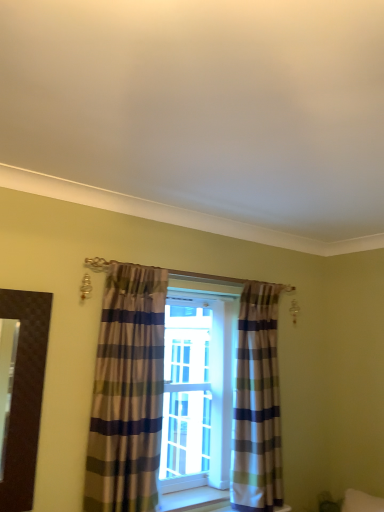
Question: From the image's perspective, is striped fabric curtain at center, the 1th curtain viewed from the right, above or below striped fabric curtain at center, which is the 1th curtain from front to back?

Choices:
 (A) below
 (B) above

Answer: (A)

Question: Looking at the image, does striped fabric curtain at center, acting as the 1th curtain starting from the back, seem bigger or smaller compared to striped fabric curtain at center, arranged as the first curtain when viewed from the left?

Choices:
 (A) small
 (B) big

Answer: (B)

Question: In the image, is striped fabric curtain at center, acting as the 1th curtain starting from the back, positioned in front of or behind striped fabric curtain at center, arranged as the first curtain when viewed from the left?

Choices:
 (A) behind
 (B) front

Answer: (A)

Question: Do you think striped fabric curtain at center, which is the 1th curtain from front to back, is within striped fabric curtain at center, the 2th curtain viewed from the front, or outside of it?

Choices:
 (A) outside
 (B) inside

Answer: (A)

Question: From a real-world perspective, is striped fabric curtain at center, arranged as the first curtain when viewed from the left, positioned above or below striped fabric curtain at center, acting as the 1th curtain starting from the back?

Choices:
 (A) below
 (B) above

Answer: (B)

Question: Relative to striped fabric curtain at center, which appears as the second curtain when viewed from the left, is striped fabric curtain at center, the second curtain in the back-to-front sequence, in front or behind?

Choices:
 (A) behind
 (B) front

Answer: (B)

Question: Does point (127, 268) appear closer or farther from the camera than point (271, 334)?

Choices:
 (A) closer
 (B) farther

Answer: (A)